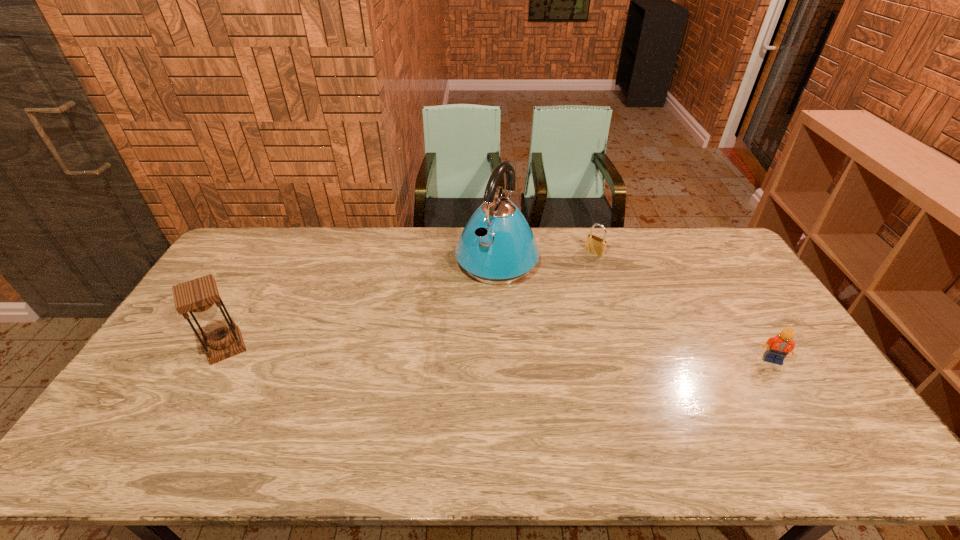
You are a GUI agent. You are given a task and a screenshot of the screen. Output one action in this format:
    pyautogui.click(x=<x>, y=<y>)
    Task: Click on the third shortest object
    The height and width of the screenshot is (540, 960).
    Given the screenshot: What is the action you would take?
    pyautogui.click(x=200, y=297)

Locate an element on the screen. hourglass is located at coordinates (200, 297).

In order to click on the rightmost object in this screenshot , I will do 778,347.

Locate an element on the screen. the second object from right to left is located at coordinates (595, 245).

Where is `the second object from left to right`? Image resolution: width=960 pixels, height=540 pixels. the second object from left to right is located at coordinates (497, 246).

This screenshot has width=960, height=540. Find the location of `kettle`. kettle is located at coordinates (497, 246).

This screenshot has height=540, width=960. I want to click on vacant area located on the front of the hourglass, so click(189, 413).

At what (x,y) coordinates should I click in order to perform the action: click on vacant space situated on the front-facing side of the rightmost object. Please return your answer as a coordinate pair (x, y). The height and width of the screenshot is (540, 960). Looking at the image, I should click on (793, 393).

Identify the location of vacant space located on the front-facing side of the padlock. This screenshot has width=960, height=540. (574, 269).

The width and height of the screenshot is (960, 540). In order to click on free space located on the front-facing side of the padlock in this screenshot , I will do `click(535, 302)`.